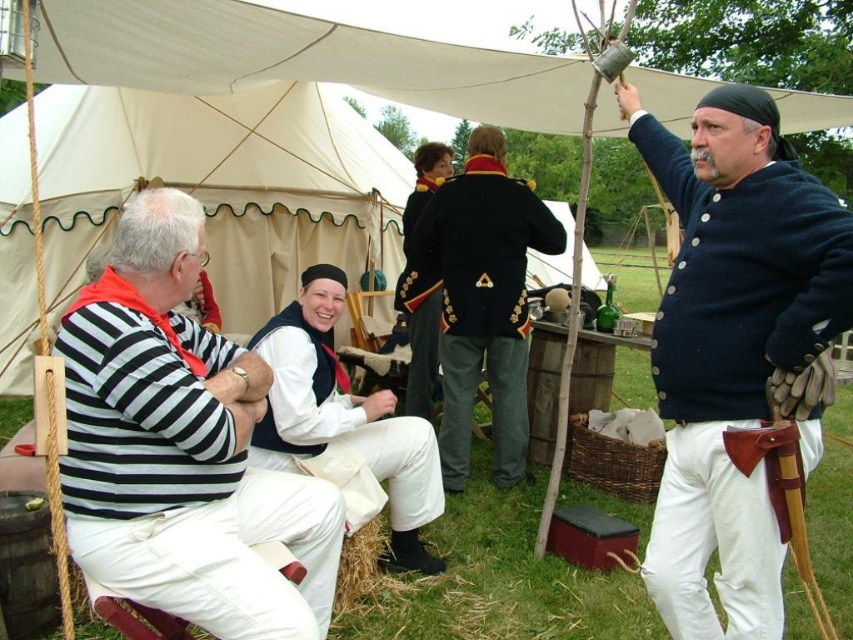
Question: Which point is closer to the camera?

Choices:
 (A) (416, 337)
 (B) (778, 221)

Answer: (B)

Question: Is dark blue woolen coat at center further to the viewer compared to white cotton vest at center?

Choices:
 (A) yes
 (B) no

Answer: (A)

Question: Does navy blue fabric shirt at upper right have a smaller size compared to dark blue woolen coat at center?

Choices:
 (A) no
 (B) yes

Answer: (B)

Question: Which object is positioned farthest from the dark blue woolen coat at center?

Choices:
 (A) shiny black coat at center
 (B) navy blue fabric shirt at upper right
 (C) striped cotton shirt at center

Answer: (C)

Question: Which object is the farthest from the dark blue woolen coat at center?

Choices:
 (A) striped cotton shirt at center
 (B) navy blue fabric shirt at upper right

Answer: (A)

Question: Considering the relative positions of striped cotton shirt at center and dark blue woolen coat at center in the image provided, where is striped cotton shirt at center located with respect to dark blue woolen coat at center?

Choices:
 (A) above
 (B) below

Answer: (B)